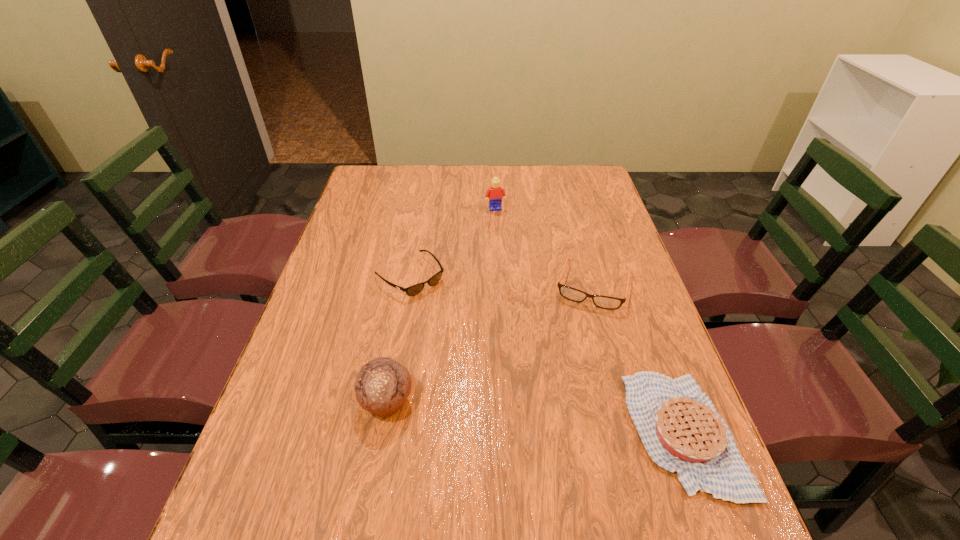
Locate an element on the screen. muffin is located at coordinates (382, 385).

In order to click on pie in this screenshot , I will do `click(679, 426)`.

Find the location of `spectacles`. spectacles is located at coordinates (605, 302).

Image resolution: width=960 pixels, height=540 pixels. Find the location of `sunglasses`. sunglasses is located at coordinates (413, 290).

Locate an element on the screen. The height and width of the screenshot is (540, 960). the third object from left to right is located at coordinates (495, 192).

I want to click on the farthest object, so 495,192.

Where is `vacant space located 0.240m on the right of the muffin`? The image size is (960, 540). vacant space located 0.240m on the right of the muffin is located at coordinates (524, 402).

The width and height of the screenshot is (960, 540). Identify the location of vacant space located on the left of the pie. (579, 432).

Find the location of a particular element. The image size is (960, 540). blank space located on the front-facing side of the spectacles is located at coordinates (x=578, y=341).

Where is `vacant area situated 0.140m on the front-facing side of the spectacles`? The width and height of the screenshot is (960, 540). vacant area situated 0.140m on the front-facing side of the spectacles is located at coordinates (576, 350).